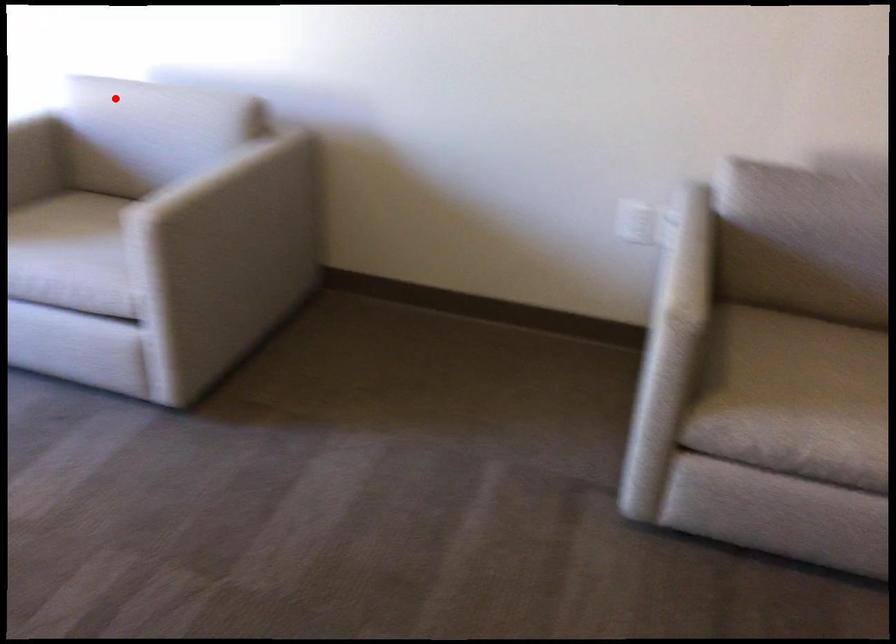
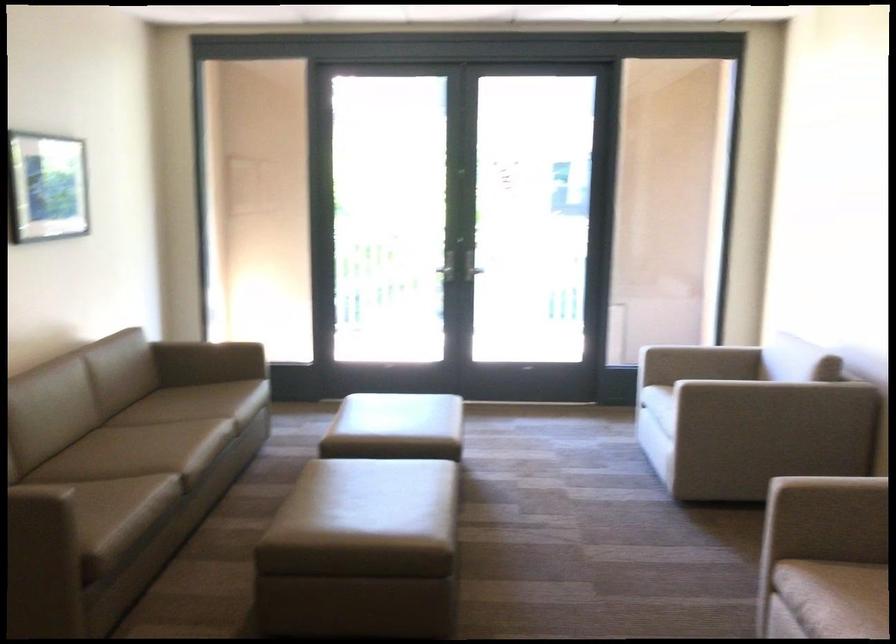
Question: I am providing you with two images of the same scene from different viewpoints. A red point is marked on the first image. At the location where the point appears in image 1, is it still visible in image 2?

Choices:
 (A) Yes
 (B) No

Answer: (A)